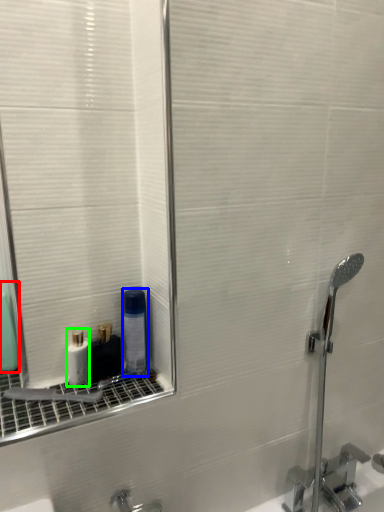
Question: Which is nearer to the mouthwash (highlighted by a red box)? mouthwash (highlighted by a blue box) or mouthwash (highlighted by a green box).

Choices:
 (A) mouthwash
 (B) mouthwash

Answer: (B)